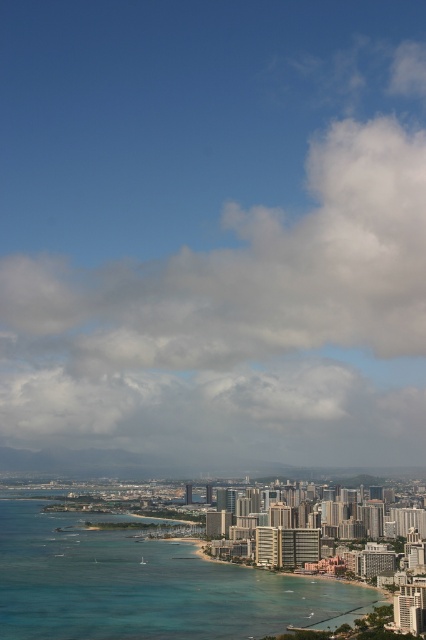
You are a drone operator who needs to fly a drone from the beach to the top of the tallest building in the midground. The drone has a maximum flight altitude of 100 meters. Considering the white fluffy cloud at upper center is located at coordinates 0.448, 0.533, will the drone be able to reach the building top without hitting the cloud?

The white fluffy cloud at upper center is located at coordinates (227,285), which means it is positioned in the upper part of the image. Since the drone must fly to the top of the tallest building in the midground, which is below the horizon, the drone should be able to reach the building top without hitting the cloud as long as its flight path stays below the cloud.

Consider the image. You are standing on the beach and looking at the white fluffy cloud at upper center and the clear blue water at lower center. Which object is nearer to you?

The white fluffy cloud at upper center is closer to the viewer than the clear blue water at lower center.